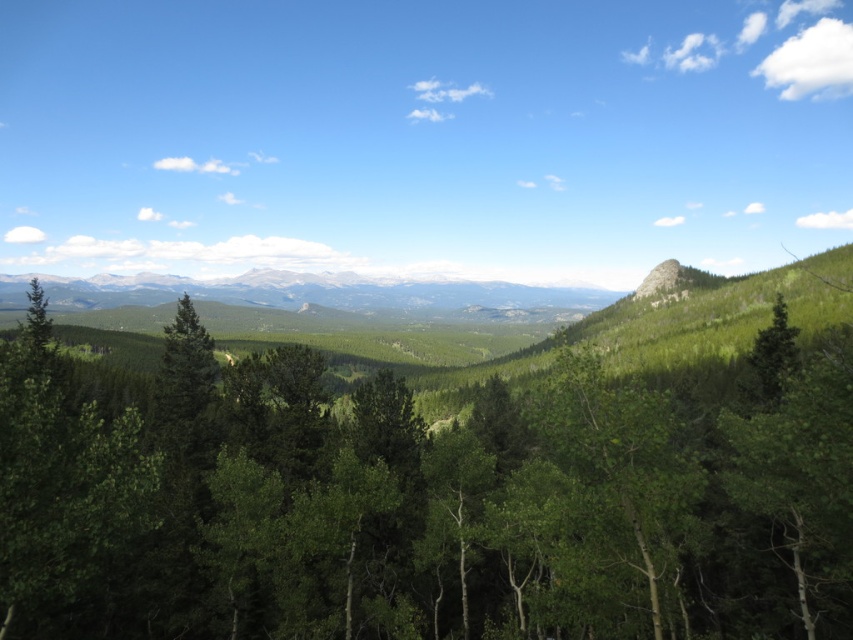
Based on the photo, does green leafy tree at center come in front of green matte tree at right?

Yes, green leafy tree at center is closer to the viewer.

Does point (215, 461) lie behind point (780, 310)?

No, it is not.

What are the coordinates of `green leafy tree at center` in the screenshot? It's located at (415, 504).

I want to click on green leafy tree at center, so click(x=415, y=504).

Can you confirm if green leafy tree at center is positioned to the right of rocky gray mountain range at center?

Indeed, green leafy tree at center is positioned on the right side of rocky gray mountain range at center.

Is green leafy tree at center to the left of rocky gray mountain range at center from the viewer's perspective?

In fact, green leafy tree at center is to the right of rocky gray mountain range at center.

Does point (260, 493) come farther from viewer compared to point (548, 285)?

That is False.

Find the location of `green leafy tree at center`. green leafy tree at center is located at coordinates (415, 504).

In the scene shown: Is rocky gray mountain range at center smaller than green matte tree at right?

No, rocky gray mountain range at center is not smaller than green matte tree at right.

Based on the photo, is rocky gray mountain range at center bigger than green matte tree at right?

Indeed, rocky gray mountain range at center has a larger size compared to green matte tree at right.

Does point (550, 285) come behind point (767, 339)?

Yes, it is behind point (767, 339).

Locate an element on the screen. rocky gray mountain range at center is located at coordinates (337, 296).